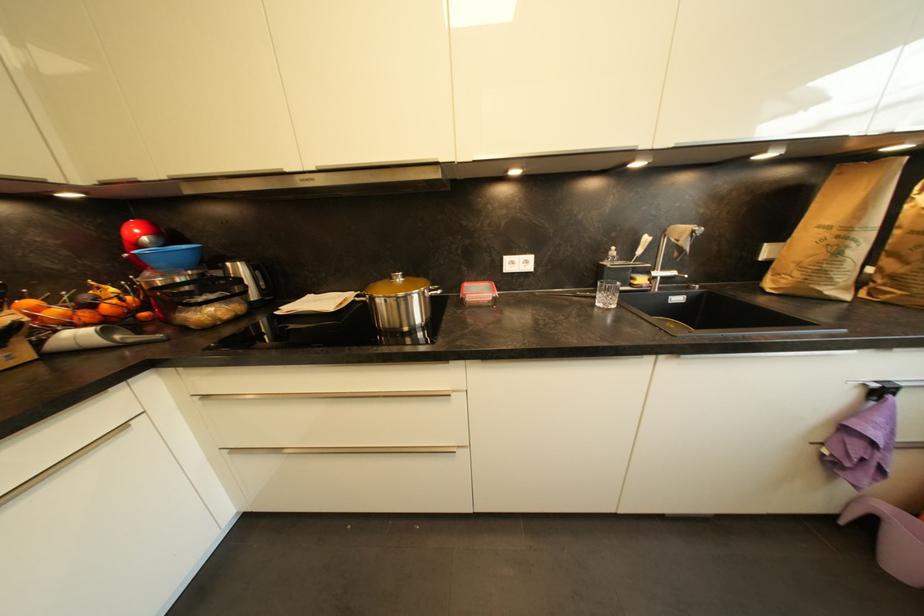
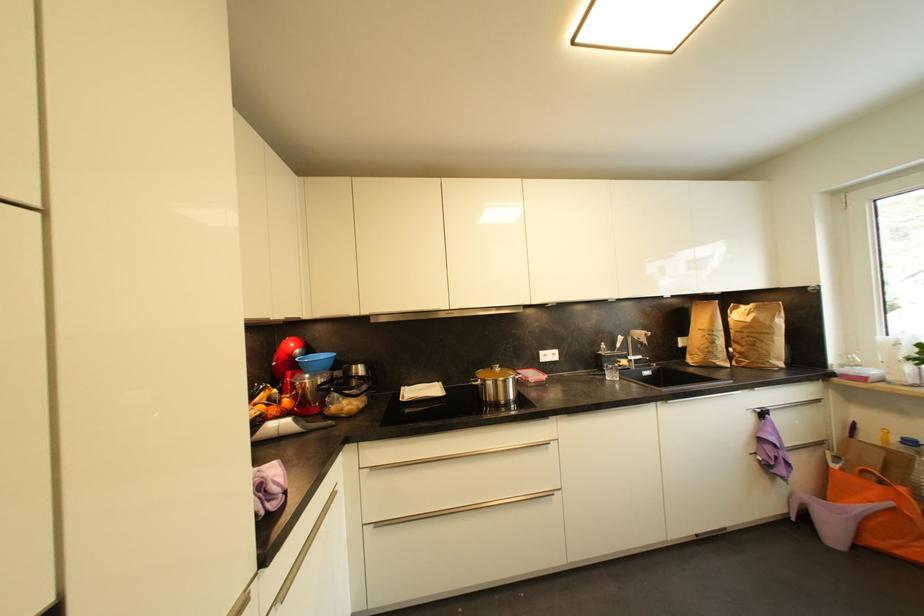
Locate, in the second image, the point that corresponds to (x=405, y=281) in the first image.

(503, 371)